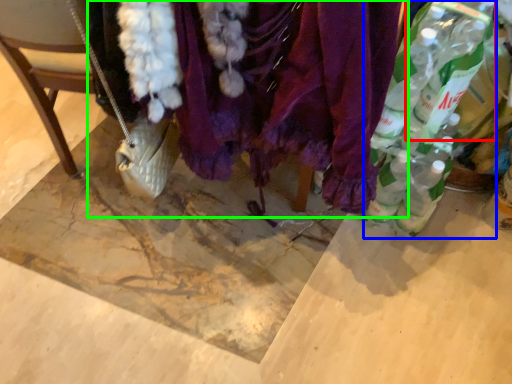
Question: Based on their relative distances, which object is farther from bottle (highlighted by a red box)? Choose from bottle (highlighted by a blue box) and textile (highlighted by a green box).

Choices:
 (A) bottle
 (B) textile

Answer: (B)